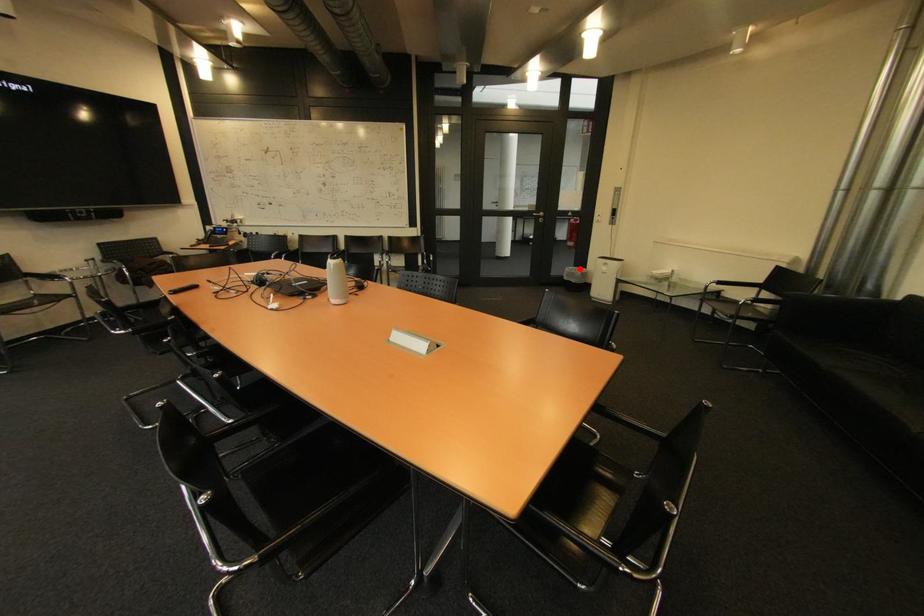
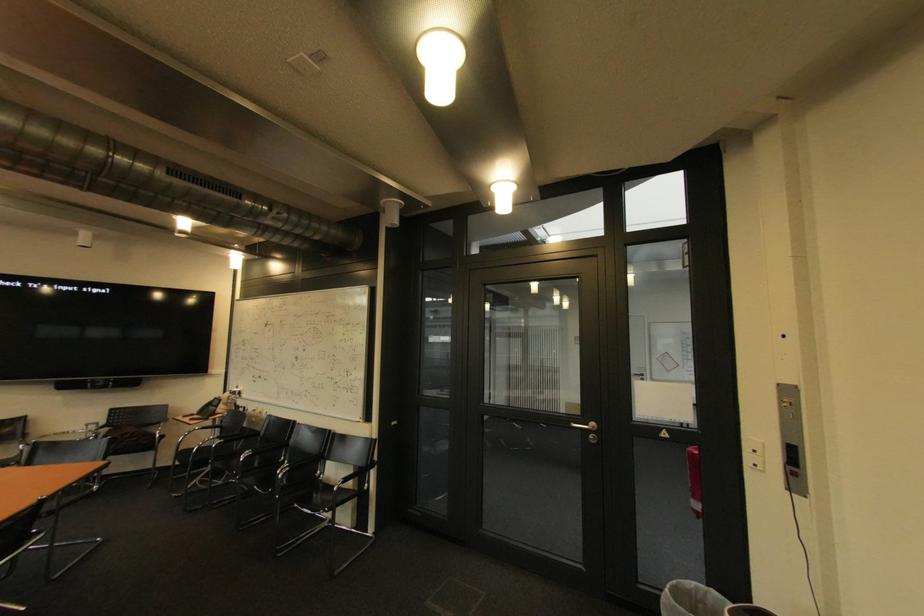
Where in the second image is the point corresponding to the highlighted location from the first image?

(701, 585)